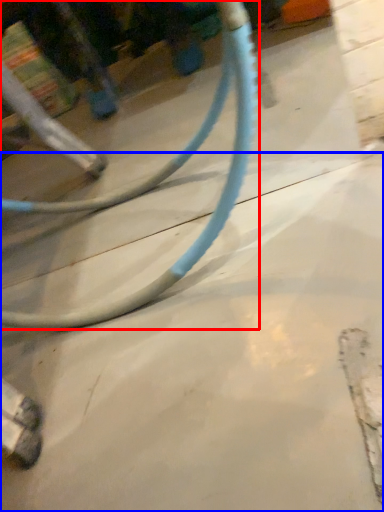
Question: Among these objects, which one is nearest to the camera, bicycle wheel (highlighted by a red box) or concrete (highlighted by a blue box)?

Choices:
 (A) bicycle wheel
 (B) concrete

Answer: (A)